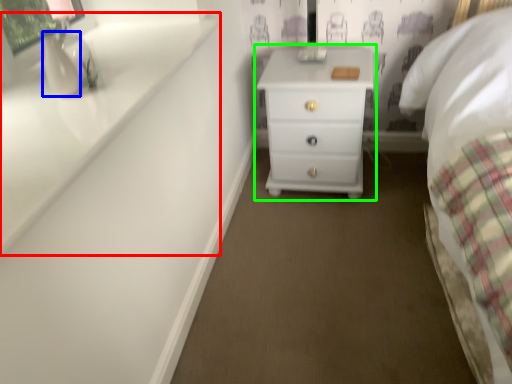
Question: Estimate the real-world distances between objects in this image. Which object is closer to window sill (highlighted by a red box), vase (highlighted by a blue box) or chest of drawers (highlighted by a green box)?

Choices:
 (A) vase
 (B) chest of drawers

Answer: (A)